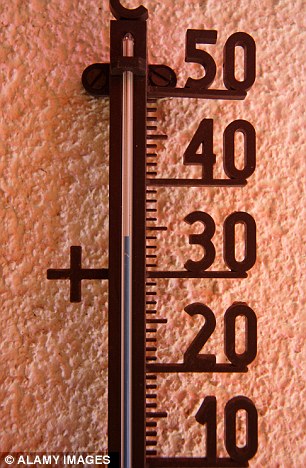
Where is `wall`? The height and width of the screenshot is (468, 306). wall is located at coordinates (265, 395), (57, 378).